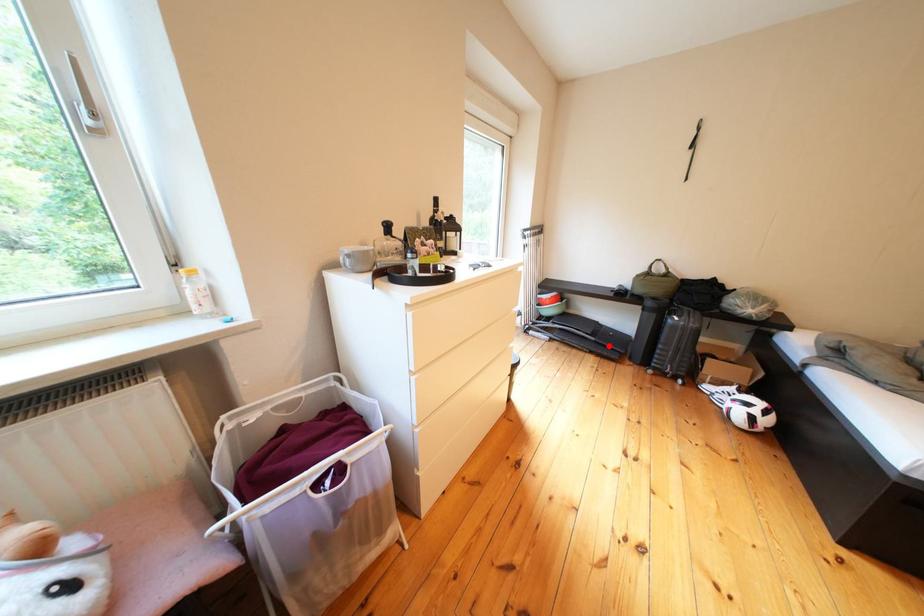
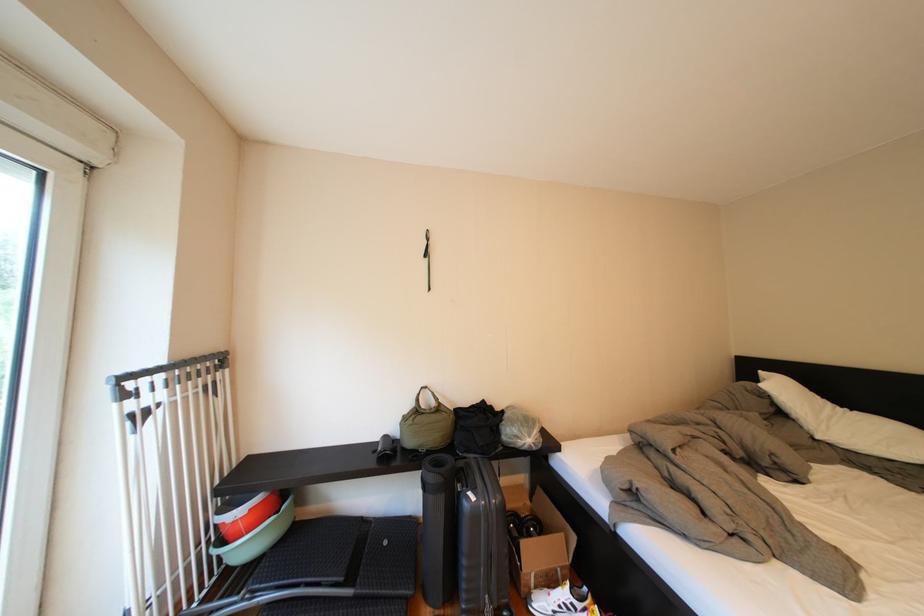
Question: I am providing you with two images of the same scene from different viewpoints. Given a red point in image1, look at the same physical point in image2. Is it:

Choices:
 (A) Closer to the viewpoint
 (B) Farther from the viewpoint

Answer: (A)